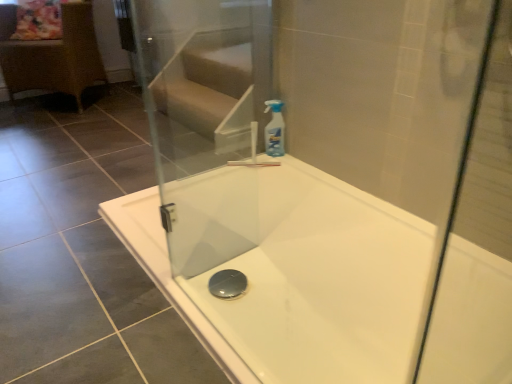
You are a GUI agent. You are given a task and a screenshot of the screen. Output one action in this format:
    pyautogui.click(x=<x>, y=<y>)
    Task: Click on the vacant area situated below white glossy bathtub at center (from a real-world perspective)
    This screenshot has width=512, height=384.
    Given the screenshot: What is the action you would take?
    pyautogui.click(x=287, y=291)